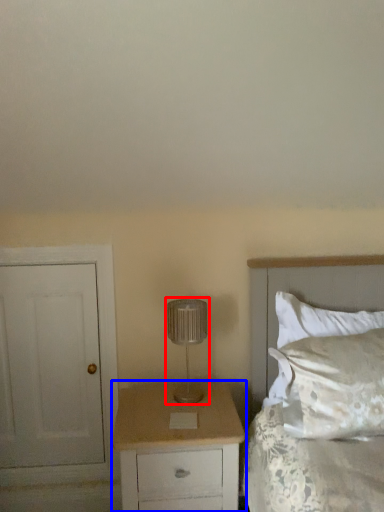
Question: Which point is closer to the camera, lamp (highlighted by a red box) or chest of drawers (highlighted by a blue box)?

Choices:
 (A) lamp
 (B) chest of drawers

Answer: (B)